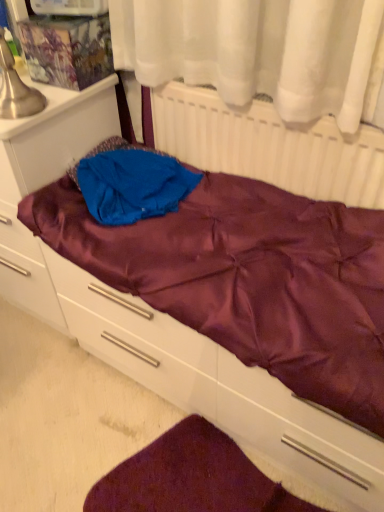
Question: Is point (144, 181) closer or farther from the camera than point (29, 252)?

Choices:
 (A) farther
 (B) closer

Answer: (B)

Question: In terms of height, does blue fabric at center look taller or shorter compared to satin purple file cabinet at left?

Choices:
 (A) short
 (B) tall

Answer: (A)

Question: Estimate the real-world distances between objects in this image. Which object is closer to the satin purple file cabinet at left?

Choices:
 (A) velvety maroon mat at lower center
 (B) white matte radiator at upper center
 (C) satin purple drawer at lower center
 (D) blue fabric at center

Answer: (D)

Question: Estimate the real-world distances between objects in this image. Which object is closer to the blue fabric at center?

Choices:
 (A) satin purple file cabinet at left
 (B) satin purple drawer at lower center
 (C) velvety maroon mat at lower center
 (D) white matte radiator at upper center

Answer: (A)